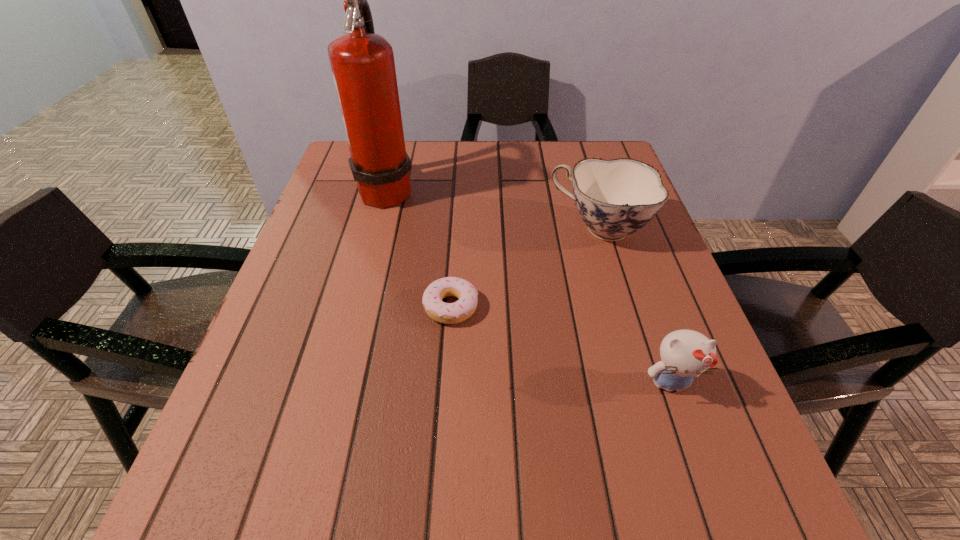
Choose which object is the nearest neighbor to the chinaware. Please provide its 2D coordinates. Your answer should be formatted as a tuple, i.e. [(x, y)], where the tuple contains the x and y coordinates of a point satisfying the conditions above.

[(447, 313)]

At what (x,y) coordinates should I click in order to perform the action: click on object that is the third closest to the third object from right to left. Please return your answer as a coordinate pair (x, y). Image resolution: width=960 pixels, height=540 pixels. Looking at the image, I should click on (685, 354).

The width and height of the screenshot is (960, 540). In order to click on vacant space that satisfies the following two spatial constraints: 1. on the back side of the chinaware; 2. on the right side of the third farthest object in this screenshot , I will do `click(456, 228)`.

Locate an element on the screen. The image size is (960, 540). vacant space that satisfies the following two spatial constraints: 1. at the nozzle of the shortest object; 2. on the left side of the leftmost object is located at coordinates (356, 307).

Locate an element on the screen. free location that satisfies the following two spatial constraints: 1. on the back side of the chinaware; 2. at the nozzle of the fire extinguisher is located at coordinates (588, 190).

At what (x,y) coordinates should I click in order to perform the action: click on vacant area in the image that satisfies the following two spatial constraints: 1. on the back side of the chinaware; 2. at the nozzle of the fire extinguisher. Please return your answer as a coordinate pair (x, y). Image resolution: width=960 pixels, height=540 pixels. Looking at the image, I should click on (588, 190).

Identify the location of free spot that satisfies the following two spatial constraints: 1. at the nozzle of the doughnut; 2. on the right side of the fire extinguisher. The height and width of the screenshot is (540, 960). (356, 307).

Where is `vacant area in the image that satisfies the following two spatial constraints: 1. on the back side of the third farthest object; 2. on the left side of the chinaware`? This screenshot has height=540, width=960. vacant area in the image that satisfies the following two spatial constraints: 1. on the back side of the third farthest object; 2. on the left side of the chinaware is located at coordinates (456, 228).

At what (x,y) coordinates should I click in order to perform the action: click on free space that satisfies the following two spatial constraints: 1. on the back side of the chinaware; 2. at the nozzle of the leftmost object. Please return your answer as a coordinate pair (x, y). Looking at the image, I should click on (588, 190).